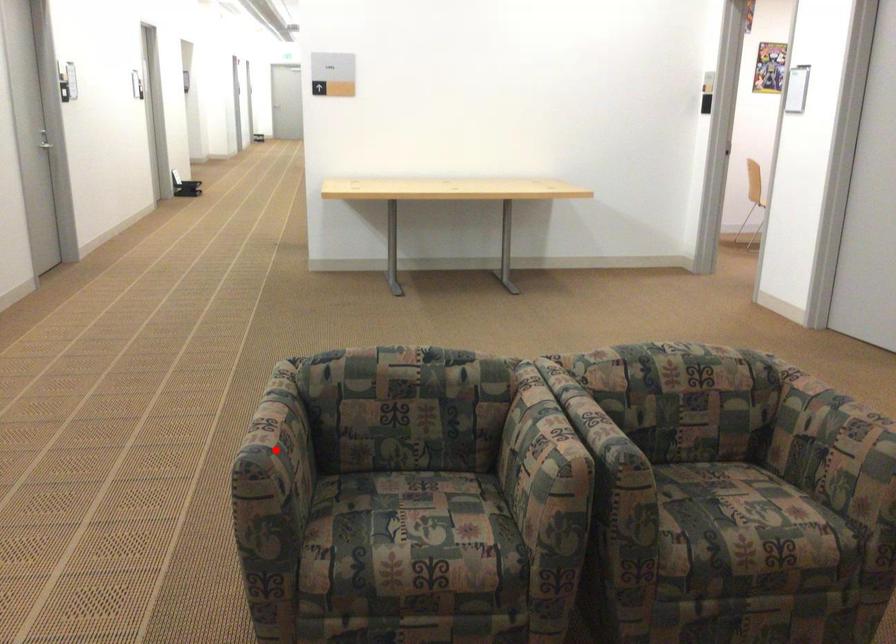
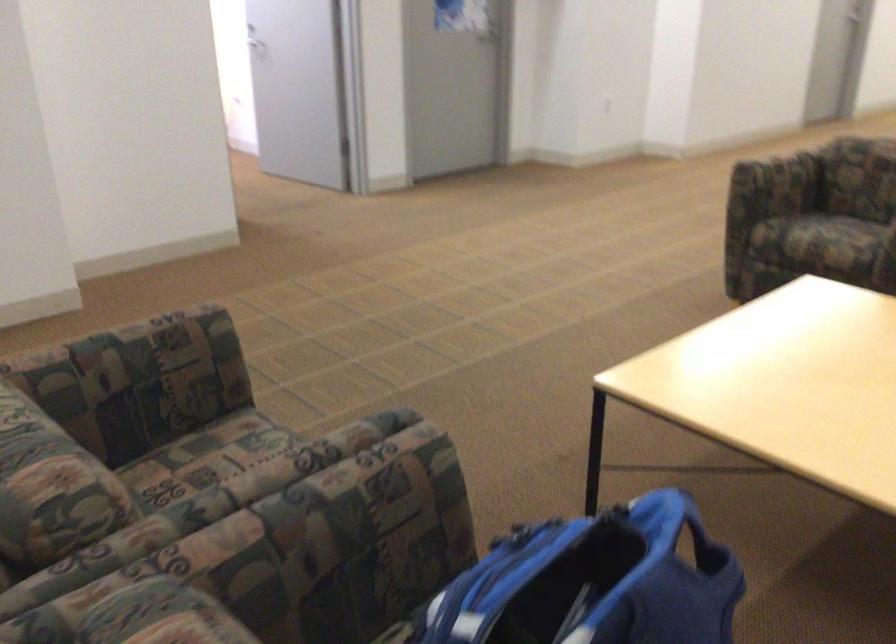
Question: I am providing you with two images of the same scene from different viewpoints. A red point is marked on the first image. Is the red point's position out of view in image 2?

Choices:
 (A) Yes
 (B) No

Answer: (A)